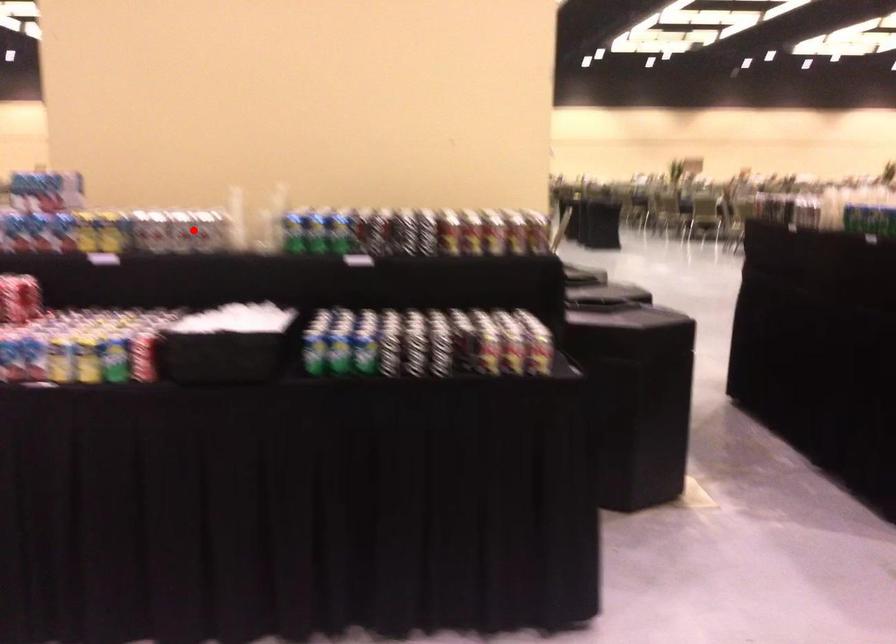
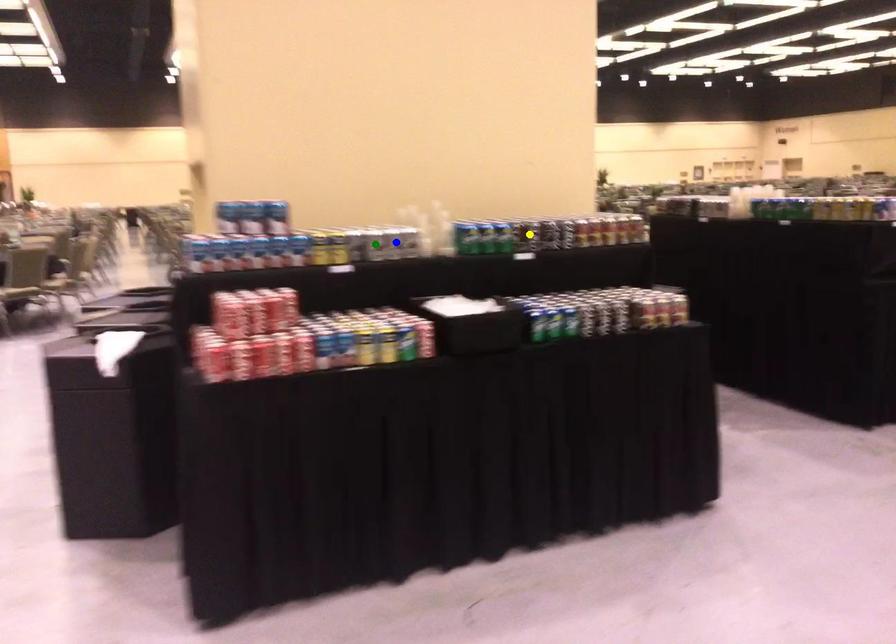
Question: I am providing you with two images of the same scene from different viewpoints. A red point is marked on the first image. You are given multiple points on the second image. Which point in image 2 represents the same 3d spot as the red point in image 1?

Choices:
 (A) yellow point
 (B) green point
 (C) blue point

Answer: (C)